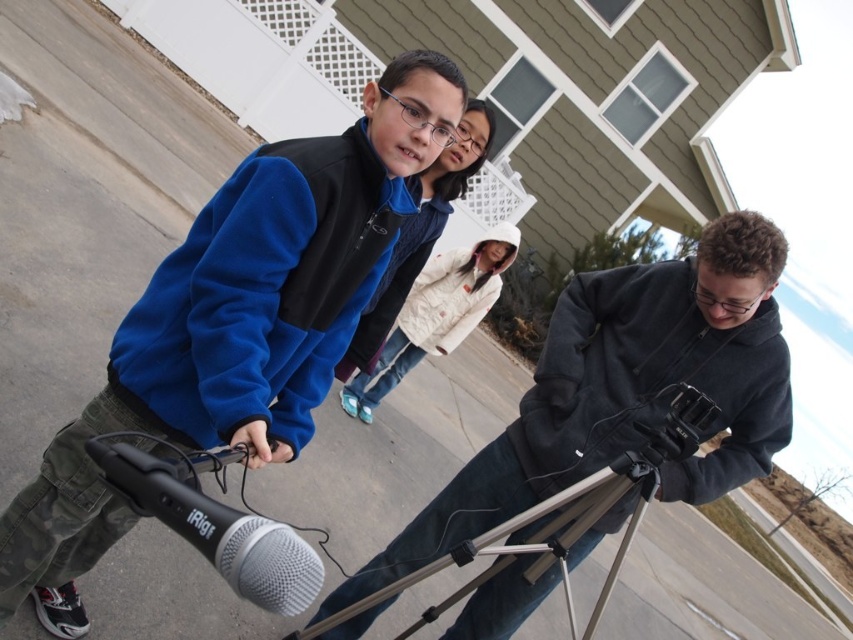
From the picture: You are a photographer trying to capture a photo of the dark gray hoodie at center and the black plastic video camera at lower right. From your current position, which object will appear closer to the bottom of the photo?

The dark gray hoodie at center appears closer to the bottom of the photo because it is positioned below the black plastic video camera at lower right in the scene.

You are a photographer trying to position a new light source in the scene. The scene has a point at coordinates (419,234). What object is located at this point?

The point at coordinates (419,234) corresponds to the white fleece jacket at center.